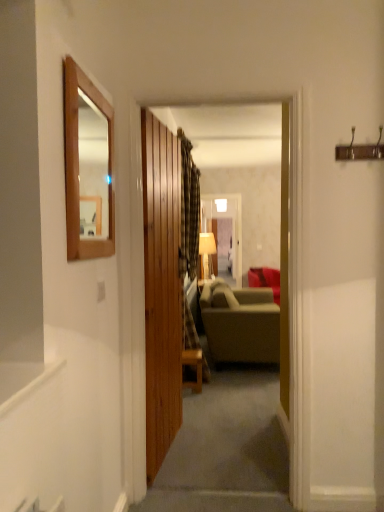
This screenshot has height=512, width=384. I want to click on vacant region below wooden door at center (from a real-world perspective), so click(x=164, y=459).